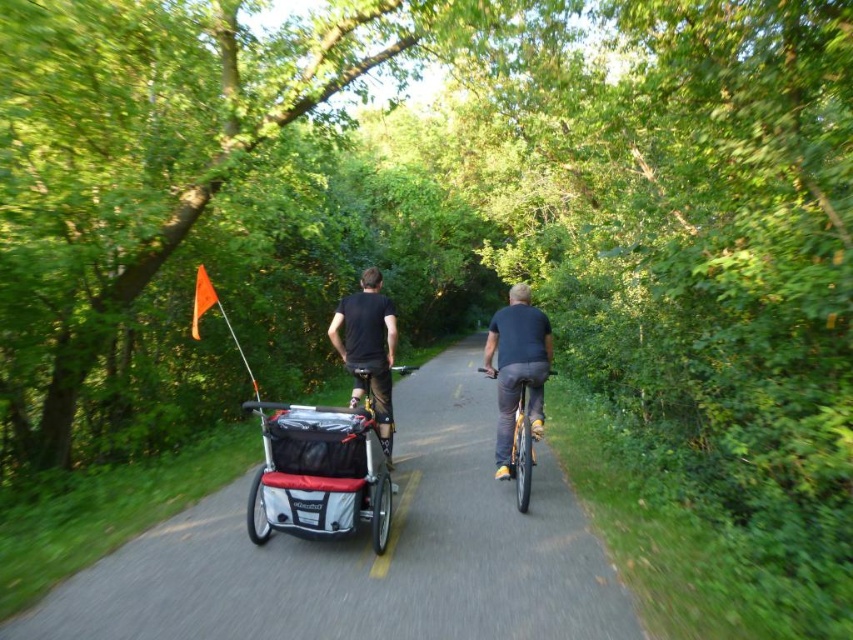
Does black plastic stroller at center have a larger size compared to black matte shirt at center?

Yes.

Measure the distance between point (270, 579) and camera.

They are 4.25 meters apart.

Find the location of a particular element. This screenshot has width=853, height=640. black plastic stroller at center is located at coordinates (368, 554).

The width and height of the screenshot is (853, 640). Identify the location of dark blue shirt at center. (517, 365).

Who is lower down, dark blue shirt at center or shiny silver bicycle at center?

shiny silver bicycle at center

Image resolution: width=853 pixels, height=640 pixels. Identify the location of dark blue shirt at center. (517, 365).

Which is below, black plastic stroller at center or dark blue shirt at center?

black plastic stroller at center is lower down.

Does black plastic stroller at center have a smaller size compared to dark blue shirt at center?

Incorrect, black plastic stroller at center is not smaller in size than dark blue shirt at center.

Measure the distance between point (292, 618) and camera.

Point (292, 618) is 3.68 meters from camera.

This screenshot has height=640, width=853. What are the coordinates of `black plastic stroller at center` in the screenshot? It's located at (368, 554).